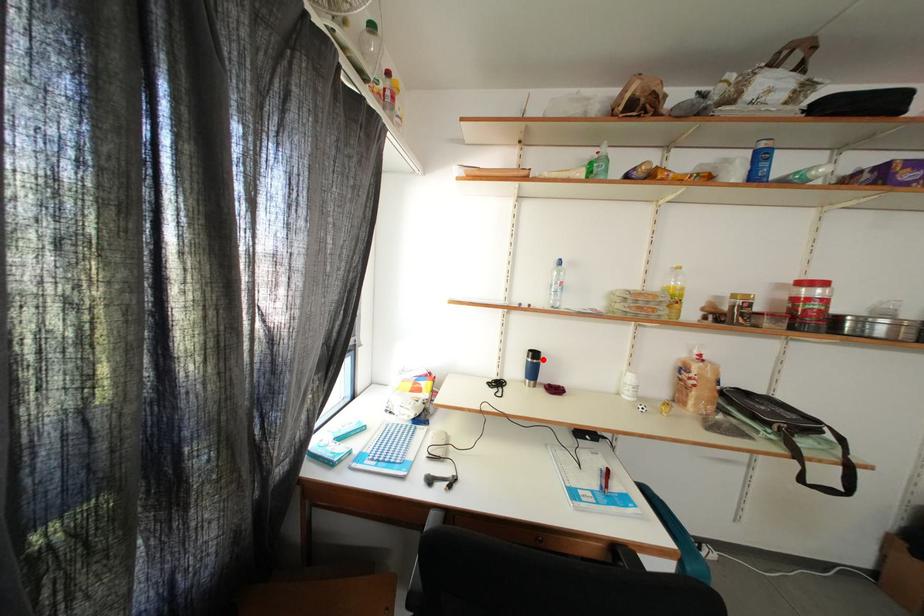
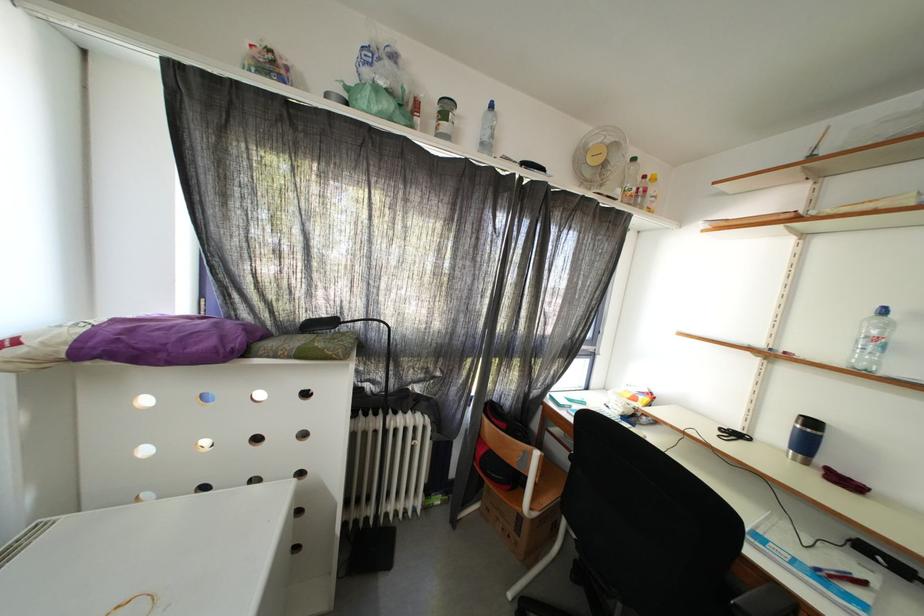
Question: I am providing you with two images of the same scene from different viewpoints. A red point is marked on the first image. Can you still see the location of the red point in image 2?

Choices:
 (A) Yes
 (B) No

Answer: (A)